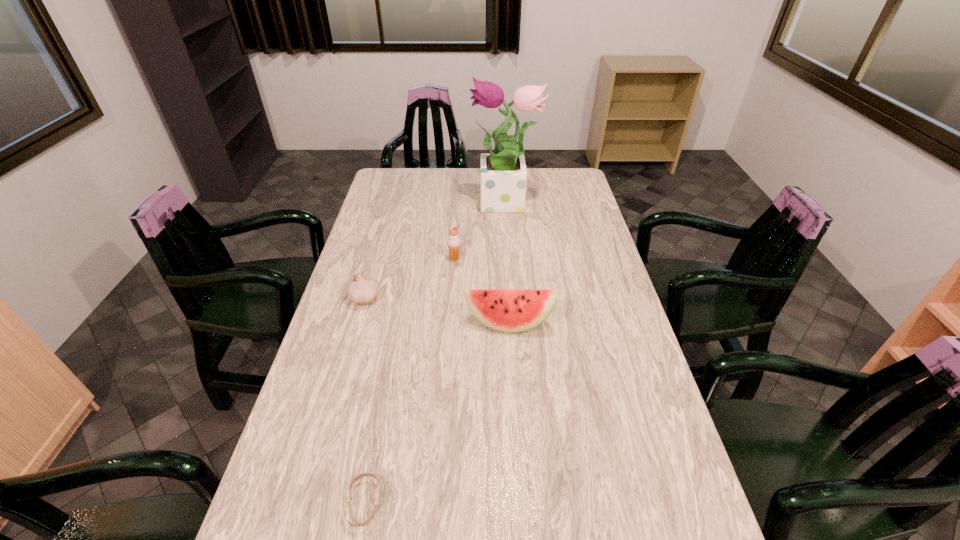
Identify the location of the tallest object. (503, 171).

Where is `the farthest object`? The height and width of the screenshot is (540, 960). the farthest object is located at coordinates (503, 171).

Find the location of a particular element. watermelon is located at coordinates (506, 310).

Find the location of a particular element. This screenshot has height=540, width=960. icecream is located at coordinates (453, 242).

Identify the location of the third object from left to right. The width and height of the screenshot is (960, 540). (453, 242).

Locate an element on the screen. Image resolution: width=960 pixels, height=540 pixels. the leftmost object is located at coordinates (361, 290).

This screenshot has width=960, height=540. In order to click on the third nearest object in this screenshot , I will do `click(361, 290)`.

At what (x,y) coordinates should I click in order to perform the action: click on the fourth object from right to left. Please return your answer as a coordinate pair (x, y). Looking at the image, I should click on (x=378, y=495).

You are a GUI agent. You are given a task and a screenshot of the screen. Output one action in this format:
    pyautogui.click(x=<x>, y=<y>)
    Task: Click on the watch
    This screenshot has width=960, height=540.
    Given the screenshot: What is the action you would take?
    pyautogui.click(x=378, y=495)

Find the location of a particular element. vacant space located on the front-facing side of the flower arrangement is located at coordinates coord(456,204).